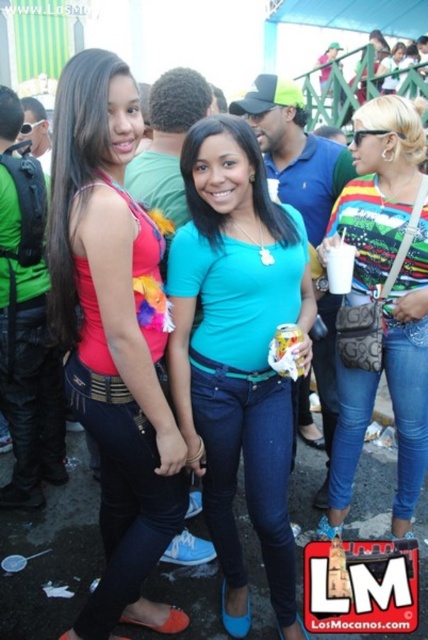
Question: Which point is farther to the camera?

Choices:
 (A) matte teal shirt at center
 (B) matte red tank top at left

Answer: (A)

Question: Which point appears closest to the camera in this image?

Choices:
 (A) (71, 298)
 (B) (353, 244)

Answer: (A)

Question: Does matte red tank top at left appear over multicolored jersey at center?

Choices:
 (A) yes
 (B) no

Answer: (B)

Question: Is matte red tank top at left smaller than multicolored jersey at center?

Choices:
 (A) yes
 (B) no

Answer: (B)

Question: Does matte teal shirt at center appear on the left side of multicolored jersey at center?

Choices:
 (A) yes
 (B) no

Answer: (A)

Question: Which object is closer to the camera taking this photo?

Choices:
 (A) matte red tank top at left
 (B) matte teal shirt at center

Answer: (A)